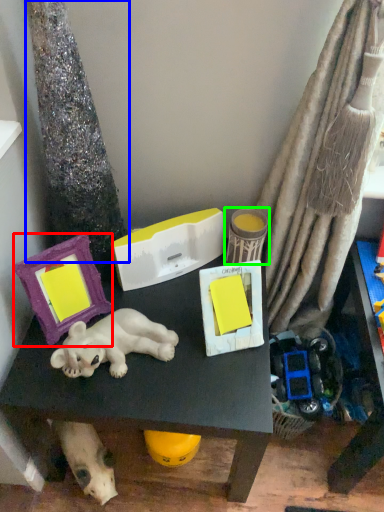
Question: Which is farther away from picture frame (highlighted by a red box)? tree trunk (highlighted by a blue box) or toy (highlighted by a green box)?

Choices:
 (A) tree trunk
 (B) toy

Answer: (B)